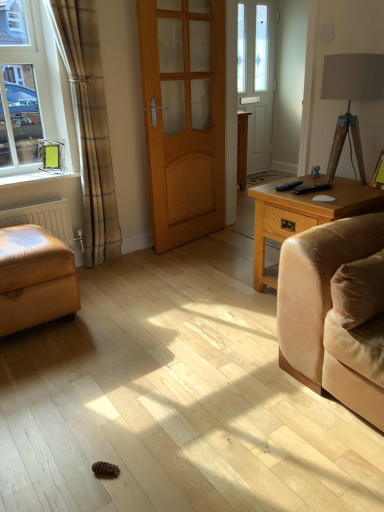
At what (x,y) coordinates should I click in order to perform the action: click on vacant space to the right of leather armchair at left. Please return your answer as a coordinate pair (x, y). The width and height of the screenshot is (384, 512). Looking at the image, I should click on (129, 310).